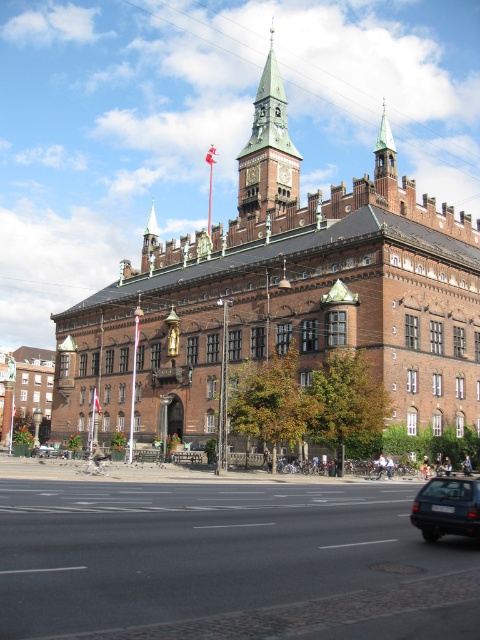
Who is more forward, (266, 148) or (425, 531)?

Point (425, 531)

Is point (269, 81) behind point (453, 483)?

Yes, it is behind point (453, 483).

Find the location of a particular element. green copper clock tower at upper center is located at coordinates (267, 150).

How far apart are green copper tower at upper center and blue metallic car at lower right?

54.06 meters

Describe the element at coordinates (284, 296) in the screenshot. The image size is (480, 640). I see `green copper tower at upper center` at that location.

Find the location of a particular element. green copper tower at upper center is located at coordinates pos(284,296).

Consider the image. Is green copper tower at upper center in front of metallic silver car at center?

Yes, it is in front of metallic silver car at center.

Which is in front, point (60, 397) or point (36, 451)?

Point (36, 451)

Where is `green copper tower at upper center`? This screenshot has height=640, width=480. green copper tower at upper center is located at coordinates (284, 296).